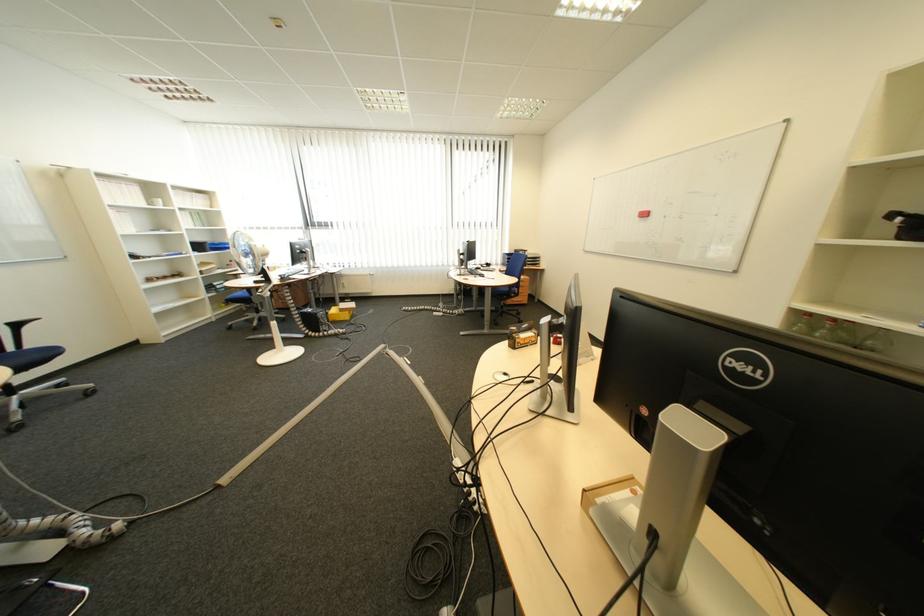
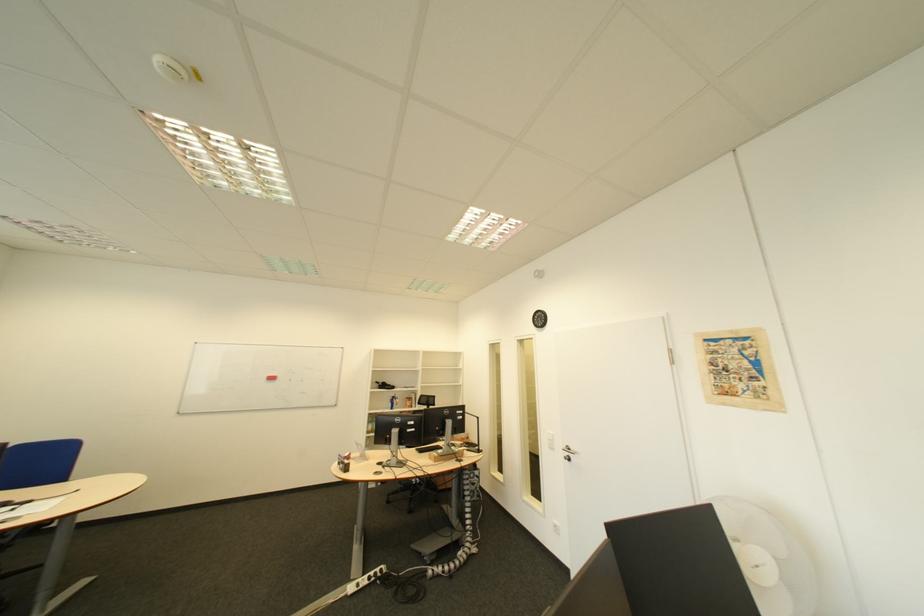
The point at [658,216] is marked in the first image. Where is the corresponding point in the second image?

(285, 379)